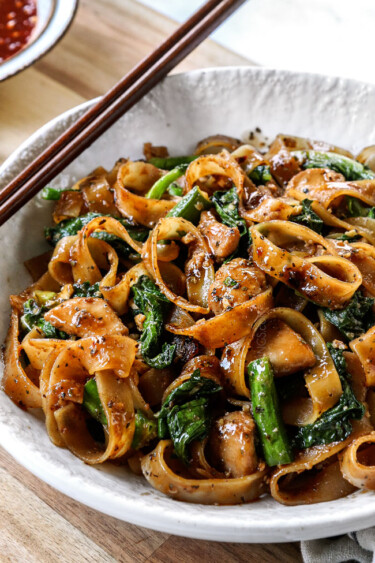
The height and width of the screenshot is (563, 375). I want to click on white bowl, so click(111, 497).